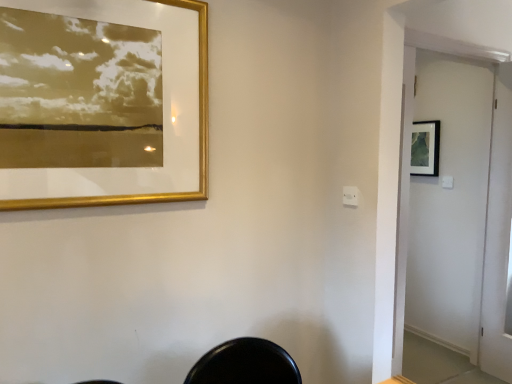
This screenshot has width=512, height=384. What do you see at coordinates (450, 203) in the screenshot? I see `white glossy screen door at right` at bounding box center [450, 203].

Measure the distance between point (454, 222) and camera.

The depth of point (454, 222) is 3.12 meters.

What do you see at coordinates (199, 142) in the screenshot? I see `gold metallic picture frame at upper left, the second picture frame viewed from the back` at bounding box center [199, 142].

Locate an element on the screen. This screenshot has width=512, height=384. matte black picture frame at upper right, which is counted as the 1th picture frame, starting from the right is located at coordinates (425, 148).

Which object is wider, white glossy screen door at right or matte black picture frame at upper right, which is counted as the 1th picture frame, starting from the right?

white glossy screen door at right.

From the image's perspective, which is above, white glossy screen door at right or matte black picture frame at upper right, the 1th picture frame when ordered from back to front?

matte black picture frame at upper right, the 1th picture frame when ordered from back to front, appears higher in the image.

Which object is further away from the camera, white glossy screen door at right or matte black picture frame at upper right, which is counted as the 1th picture frame, starting from the right?

matte black picture frame at upper right, which is counted as the 1th picture frame, starting from the right, is more distant.

Considering the relative positions of white glossy screen door at right and gold metallic picture frame at upper left, acting as the second picture frame starting from the right, in the image provided, is white glossy screen door at right to the left of gold metallic picture frame at upper left, acting as the second picture frame starting from the right, from the viewer's perspective?

In fact, white glossy screen door at right is to the right of gold metallic picture frame at upper left, acting as the second picture frame starting from the right.

Are white glossy screen door at right and gold metallic picture frame at upper left, placed as the first picture frame when sorted from front to back, beside each other?

white glossy screen door at right is not next to gold metallic picture frame at upper left, placed as the first picture frame when sorted from front to back, and they're not touching.

Considering the sizes of white glossy screen door at right and gold metallic picture frame at upper left, placed as the first picture frame when sorted from front to back, in the image, is white glossy screen door at right taller or shorter than gold metallic picture frame at upper left, placed as the first picture frame when sorted from front to back,?

Clearly, white glossy screen door at right is taller compared to gold metallic picture frame at upper left, placed as the first picture frame when sorted from front to back.

Which is in front, matte black picture frame at upper right, which is the second picture frame in left-to-right order, or gold metallic picture frame at upper left, placed as the first picture frame when sorted from front to back?

Positioned in front is gold metallic picture frame at upper left, placed as the first picture frame when sorted from front to back.

Visually, is matte black picture frame at upper right, which is counted as the 1th picture frame, starting from the right, positioned to the left or to the right of gold metallic picture frame at upper left, acting as the second picture frame starting from the right?

matte black picture frame at upper right, which is counted as the 1th picture frame, starting from the right, is positioned on gold metallic picture frame at upper left, acting as the second picture frame starting from the right,'s right side.

Can you confirm if matte black picture frame at upper right, the 2th picture frame when ordered from front to back, is shorter than gold metallic picture frame at upper left, which appears as the first picture frame when viewed from the left?

Correct, matte black picture frame at upper right, the 2th picture frame when ordered from front to back, is not as tall as gold metallic picture frame at upper left, which appears as the first picture frame when viewed from the left.

Is matte black picture frame at upper right, the 2th picture frame when ordered from front to back, taller than white glossy screen door at right?

In fact, matte black picture frame at upper right, the 2th picture frame when ordered from front to back, may be shorter than white glossy screen door at right.

How much distance is there between matte black picture frame at upper right, the 1th picture frame when ordered from back to front, and white glossy screen door at right?

They are 14.20 inches apart.

Does point (422, 164) come in front of point (474, 342)?

That is False.

Considering the sizes of objects matte black picture frame at upper right, the 1th picture frame when ordered from back to front, and white glossy screen door at right in the image provided, who is bigger, matte black picture frame at upper right, the 1th picture frame when ordered from back to front, or white glossy screen door at right?

Bigger between the two is white glossy screen door at right.

From a real-world perspective, which is physically below, gold metallic picture frame at upper left, acting as the second picture frame starting from the right, or white glossy screen door at right?

From a 3D spatial view, white glossy screen door at right is below.

From their relative heights in the image, would you say gold metallic picture frame at upper left, which appears as the first picture frame when viewed from the left, is taller or shorter than white glossy screen door at right?

Considering their sizes, gold metallic picture frame at upper left, which appears as the first picture frame when viewed from the left, has less height than white glossy screen door at right.

Is gold metallic picture frame at upper left, placed as the first picture frame when sorted from front to back, directly adjacent to white glossy screen door at right?

No, gold metallic picture frame at upper left, placed as the first picture frame when sorted from front to back, is not touching white glossy screen door at right.

Is gold metallic picture frame at upper left, which appears as the first picture frame when viewed from the left, with matte black picture frame at upper right, the 2th picture frame when ordered from front to back?

No, gold metallic picture frame at upper left, which appears as the first picture frame when viewed from the left, is not with matte black picture frame at upper right, the 2th picture frame when ordered from front to back.

From a real-world perspective, is gold metallic picture frame at upper left, placed as the first picture frame when sorted from front to back, located higher than matte black picture frame at upper right, which is counted as the 1th picture frame, starting from the right?

Yes, from a real-world perspective, gold metallic picture frame at upper left, placed as the first picture frame when sorted from front to back, is over matte black picture frame at upper right, which is counted as the 1th picture frame, starting from the right

From the image's perspective, is gold metallic picture frame at upper left, the second picture frame viewed from the back, on top of matte black picture frame at upper right, the 1th picture frame when ordered from back to front?

Actually, gold metallic picture frame at upper left, the second picture frame viewed from the back, appears below matte black picture frame at upper right, the 1th picture frame when ordered from back to front, in the image.

Measure the distance between gold metallic picture frame at upper left, which appears as the first picture frame when viewed from the left, and matte black picture frame at upper right, the 2th picture frame when ordered from front to back.

gold metallic picture frame at upper left, which appears as the first picture frame when viewed from the left, and matte black picture frame at upper right, the 2th picture frame when ordered from front to back, are 7.47 feet apart.

This screenshot has width=512, height=384. What are the coordinates of `picture frame that is the 1st one above the white glossy screen door at right (from a real-world perspective)` in the screenshot? It's located at (425, 148).

Identify the location of the 1st picture frame positioned above the white glossy screen door at right (from the image's perspective). (199, 142).

Looking at the image, which one is located closer to matte black picture frame at upper right, the 1th picture frame when ordered from back to front, white glossy screen door at right or gold metallic picture frame at upper left, acting as the second picture frame starting from the right?

white glossy screen door at right lies closer to matte black picture frame at upper right, the 1th picture frame when ordered from back to front, than the other object.

Estimate the real-world distances between objects in this image. Which object is further from gold metallic picture frame at upper left, the second picture frame viewed from the back, matte black picture frame at upper right, which is counted as the 1th picture frame, starting from the right, or white glossy screen door at right?

matte black picture frame at upper right, which is counted as the 1th picture frame, starting from the right, lies further to gold metallic picture frame at upper left, the second picture frame viewed from the back, than the other object.

Considering their positions, is gold metallic picture frame at upper left, the second picture frame viewed from the back, positioned closer to matte black picture frame at upper right, which is counted as the 1th picture frame, starting from the right, than white glossy screen door at right?

white glossy screen door at right is closer to matte black picture frame at upper right, which is counted as the 1th picture frame, starting from the right.

When comparing their distances from gold metallic picture frame at upper left, which appears as the first picture frame when viewed from the left, does white glossy screen door at right or matte black picture frame at upper right, the 1th picture frame when ordered from back to front, seem closer?

white glossy screen door at right.

From the image, which object appears to be nearer to white glossy screen door at right, matte black picture frame at upper right, which is the second picture frame in left-to-right order, or gold metallic picture frame at upper left, which appears as the first picture frame when viewed from the left?

matte black picture frame at upper right, which is the second picture frame in left-to-right order, lies closer to white glossy screen door at right than the other object.

Based on their spatial positions, is gold metallic picture frame at upper left, placed as the first picture frame when sorted from front to back, or matte black picture frame at upper right, which is counted as the 1th picture frame, starting from the right, closer to white glossy screen door at right?

matte black picture frame at upper right, which is counted as the 1th picture frame, starting from the right.

Where is `screen door between gold metallic picture frame at upper left, acting as the second picture frame starting from the right, and matte black picture frame at upper right, which is counted as the 1th picture frame, starting from the right, from left to right`? The height and width of the screenshot is (384, 512). screen door between gold metallic picture frame at upper left, acting as the second picture frame starting from the right, and matte black picture frame at upper right, which is counted as the 1th picture frame, starting from the right, from left to right is located at coordinates (450, 203).